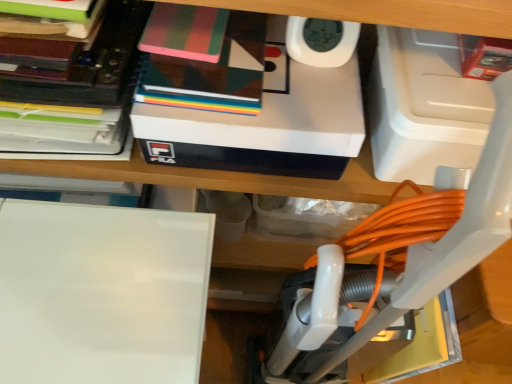
Question: From a real-world perspective, is white plastic vacuum at center below white glossy board at lower left?

Choices:
 (A) no
 (B) yes

Answer: (A)

Question: Is white plastic vacuum at center smaller than white glossy board at lower left?

Choices:
 (A) yes
 (B) no

Answer: (B)

Question: Does white plastic vacuum at center appear on the left side of white glossy board at lower left?

Choices:
 (A) yes
 (B) no

Answer: (B)

Question: Can you confirm if white plastic vacuum at center is thinner than white glossy board at lower left?

Choices:
 (A) yes
 (B) no

Answer: (A)

Question: Is white plastic vacuum at center at the right side of white glossy board at lower left?

Choices:
 (A) yes
 (B) no

Answer: (A)

Question: Is white glossy board at lower left inside white plastic vacuum at center?

Choices:
 (A) no
 (B) yes

Answer: (A)

Question: Is geometric-patterned notebook at upper center, the first book from the right, not inside matte black book at upper left, which is the second book in right-to-left order?

Choices:
 (A) yes
 (B) no

Answer: (A)

Question: From a real-world perspective, is geometric-patterned notebook at upper center, which is the 2th book in left-to-right order, positioned over matte black book at upper left, which is the second book in right-to-left order, based on gravity?

Choices:
 (A) no
 (B) yes

Answer: (B)

Question: Is geometric-patterned notebook at upper center, which is the 2th book in left-to-right order, shorter than matte black book at upper left, which is the second book in right-to-left order?

Choices:
 (A) no
 (B) yes

Answer: (B)

Question: Would you consider geometric-patterned notebook at upper center, the first book from the right, to be distant from matte black book at upper left, which ranks as the first book in left-to-right order?

Choices:
 (A) yes
 (B) no

Answer: (B)

Question: Does geometric-patterned notebook at upper center, which is the 2th book in left-to-right order, have a greater height compared to matte black book at upper left, which is the second book in right-to-left order?

Choices:
 (A) yes
 (B) no

Answer: (B)

Question: Can you confirm if geometric-patterned notebook at upper center, the first book from the right, is bigger than matte black book at upper left, which ranks as the first book in left-to-right order?

Choices:
 (A) yes
 (B) no

Answer: (B)

Question: Is white matte box at upper center bigger than white glossy board at lower left?

Choices:
 (A) no
 (B) yes

Answer: (A)